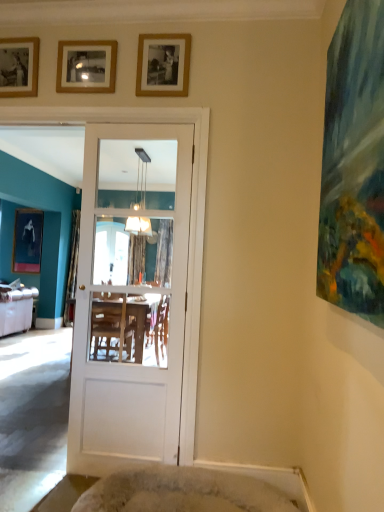
What do you see at coordinates (86, 66) in the screenshot? I see `wooden picture frame at upper center, which is counted as the second picture frame, starting from the right` at bounding box center [86, 66].

What are the coordinates of `wooden picture frame at upper center, acting as the third picture frame starting from the back` in the screenshot? It's located at (86, 66).

What is the approximate height of silky teal curtain at left?

7.11 feet.

Identify the location of silky teal curtain at left. (72, 270).

Where is `beige plush cat bed at lower center`? beige plush cat bed at lower center is located at coordinates (182, 492).

Locate an element on the screen. The image size is (384, 512). matte black portrait at left, the 1th picture frame in the left-to-right sequence is located at coordinates (27, 240).

Find the location of a particular element. wooden picture frame at upper center, which is counted as the second picture frame, starting from the right is located at coordinates (86, 66).

Considering the sizes of objects wooden photo frame at upper left, which is the second picture frame in left-to-right order, and silky teal curtain at left in the image provided, who is taller, wooden photo frame at upper left, which is the second picture frame in left-to-right order, or silky teal curtain at left?

With more height is silky teal curtain at left.

Is wooden photo frame at upper left, the 3th picture frame from the front, bigger than silky teal curtain at left?

No.

From the image's perspective, which is above, wooden photo frame at upper left, the 3th picture frame from the front, or silky teal curtain at left?

wooden photo frame at upper left, the 3th picture frame from the front, appears higher in the image.

The height and width of the screenshot is (512, 384). Identify the location of curtain behind the wooden photo frame at upper left, the 2th picture frame in the back-to-front sequence. (72, 270).

Is matte black portrait at left, arranged as the 4th picture frame when viewed from the right, with silver metallic studio couch at left?

matte black portrait at left, arranged as the 4th picture frame when viewed from the right, and silver metallic studio couch at left are not in contact.

Is matte black portrait at left, placed as the fourth picture frame when sorted from front to back, inside or outside of silver metallic studio couch at left?

matte black portrait at left, placed as the fourth picture frame when sorted from front to back, is located beyond the bounds of silver metallic studio couch at left.

Consider the image. Is matte black portrait at left, placed as the fourth picture frame when sorted from front to back, smaller than silver metallic studio couch at left?

Correct, matte black portrait at left, placed as the fourth picture frame when sorted from front to back, occupies less space than silver metallic studio couch at left.

From the image's perspective, is matte black portrait at left, placed as the fourth picture frame when sorted from front to back, above or below silver metallic studio couch at left?

Clearly, from the image's perspective, matte black portrait at left, placed as the fourth picture frame when sorted from front to back, is above silver metallic studio couch at left.

Considering the positions of objects wooden picture frame at upper center, the second picture frame in the front-to-back sequence, and matte black portrait at left, which is the first picture frame in back-to-front order, in the image provided, who is more to the right, wooden picture frame at upper center, the second picture frame in the front-to-back sequence, or matte black portrait at left, which is the first picture frame in back-to-front order,?

wooden picture frame at upper center, the second picture frame in the front-to-back sequence.

Considering the sizes of objects wooden picture frame at upper center, which is counted as the second picture frame, starting from the right, and matte black portrait at left, arranged as the 4th picture frame when viewed from the right, in the image provided, who is smaller, wooden picture frame at upper center, which is counted as the second picture frame, starting from the right, or matte black portrait at left, arranged as the 4th picture frame when viewed from the right,?

wooden picture frame at upper center, which is counted as the second picture frame, starting from the right.

Between wooden picture frame at upper center, the third picture frame when ordered from left to right, and matte black portrait at left, placed as the fourth picture frame when sorted from front to back, which one has more height?

With more height is matte black portrait at left, placed as the fourth picture frame when sorted from front to back.

Consider the image. How distant is wooden picture frame at upper center, which is counted as the second picture frame, starting from the right, from matte black portrait at left, which is the first picture frame in back-to-front order?

A distance of 4.20 meters exists between wooden picture frame at upper center, which is counted as the second picture frame, starting from the right, and matte black portrait at left, which is the first picture frame in back-to-front order.

You are a GUI agent. You are given a task and a screenshot of the screen. Output one action in this format:
    pyautogui.click(x=<x>, y=<y>)
    Task: Click on the 3rd picture frame above the silky teal curtain at left (from the image's perspective)
    
    Given the screenshot: What is the action you would take?
    pyautogui.click(x=86, y=66)

Which of these two, wooden picture frame at upper center, which is counted as the second picture frame, starting from the right, or silky teal curtain at left, is wider?

With larger width is silky teal curtain at left.

Considering the sizes of objects wooden picture frame at upper center, which is counted as the second picture frame, starting from the right, and silky teal curtain at left in the image provided, who is shorter, wooden picture frame at upper center, which is counted as the second picture frame, starting from the right, or silky teal curtain at left?

With less height is wooden picture frame at upper center, which is counted as the second picture frame, starting from the right.

Is wooden photo frame at upper left, the 2th picture frame in the back-to-front sequence, not close to wooden picture frame at upper center, the third picture frame when ordered from left to right?

No, there isn't a large distance between wooden photo frame at upper left, the 2th picture frame in the back-to-front sequence, and wooden picture frame at upper center, the third picture frame when ordered from left to right.

Where is `picture frame that is above the wooden picture frame at upper center, acting as the third picture frame starting from the back (from the image's perspective)`? picture frame that is above the wooden picture frame at upper center, acting as the third picture frame starting from the back (from the image's perspective) is located at coordinates [19, 67].

Is wooden photo frame at upper left, the 3th picture frame from the front, taller or shorter than wooden picture frame at upper center, which is counted as the second picture frame, starting from the right?

Considering their sizes, wooden photo frame at upper left, the 3th picture frame from the front, has more height than wooden picture frame at upper center, which is counted as the second picture frame, starting from the right.

Considering the relative sizes of matte black portrait at left, the 1th picture frame in the left-to-right sequence, and gold-framed photo at upper center, the first picture frame positioned from the front, in the image provided, is matte black portrait at left, the 1th picture frame in the left-to-right sequence, smaller than gold-framed photo at upper center, the first picture frame positioned from the front,?

No.

Is matte black portrait at left, placed as the fourth picture frame when sorted from front to back, facing towards gold-framed photo at upper center, the fourth picture frame when ordered from left to right?

No, matte black portrait at left, placed as the fourth picture frame when sorted from front to back, is not facing towards gold-framed photo at upper center, the fourth picture frame when ordered from left to right.

Which of these two, matte black portrait at left, which is the first picture frame in back-to-front order, or gold-framed photo at upper center, the fourth picture frame when ordered from left to right, stands taller?

With more height is matte black portrait at left, which is the first picture frame in back-to-front order.

Can you tell me how much matte black portrait at left, which is the first picture frame in back-to-front order, and gold-framed photo at upper center, the first picture frame positioned from the front, differ in facing direction?

The angle between the facing direction of matte black portrait at left, which is the first picture frame in back-to-front order, and the facing direction of gold-framed photo at upper center, the first picture frame positioned from the front, is 2.62 degrees.

Consider the image. Is beige plush cat bed at lower center to the left of matte black portrait at left, placed as the fourth picture frame when sorted from front to back, from the viewer's perspective?

No.

Is matte black portrait at left, arranged as the 4th picture frame when viewed from the right, at the back of beige plush cat bed at lower center?

No, beige plush cat bed at lower center is not facing away from matte black portrait at left, arranged as the 4th picture frame when viewed from the right.

Which is correct: beige plush cat bed at lower center is inside matte black portrait at left, arranged as the 4th picture frame when viewed from the right, or outside of it?

beige plush cat bed at lower center is located beyond the bounds of matte black portrait at left, arranged as the 4th picture frame when viewed from the right.

Who is taller, beige plush cat bed at lower center or matte black portrait at left, arranged as the 4th picture frame when viewed from the right?

matte black portrait at left, arranged as the 4th picture frame when viewed from the right, is taller.

Where is `the 1st picture frame counting from the right of the silky teal curtain at left`? the 1st picture frame counting from the right of the silky teal curtain at left is located at coordinates (19, 67).

What are the coordinates of `the 1st picture frame above the silver metallic studio couch at left (from a real-world perspective)` in the screenshot? It's located at (27, 240).

Estimate the real-world distances between objects in this image. Which object is further from gold-framed photo at upper center, the first picture frame positioned from the front, wooden photo frame at upper left, which is the second picture frame in left-to-right order, or matte black portrait at left, the 1th picture frame in the left-to-right sequence?

matte black portrait at left, the 1th picture frame in the left-to-right sequence, is further to gold-framed photo at upper center, the first picture frame positioned from the front.

From the image, which object appears to be farther from silver metallic studio couch at left, matte black portrait at left, placed as the fourth picture frame when sorted from front to back, or wooden photo frame at upper left, the 3th picture frame from the front?

Among the two, wooden photo frame at upper left, the 3th picture frame from the front, is located further to silver metallic studio couch at left.

From the image, which object appears to be nearer to wooden picture frame at upper center, acting as the third picture frame starting from the back, gold-framed photo at upper center, the fourth picture frame in the back-to-front sequence, or silver metallic studio couch at left?

Among the two, gold-framed photo at upper center, the fourth picture frame in the back-to-front sequence, is located nearer to wooden picture frame at upper center, acting as the third picture frame starting from the back.

Estimate the real-world distances between objects in this image. Which object is closer to gold-framed photo at upper center, arranged as the 1th picture frame when viewed from the right, silver metallic studio couch at left or silky teal curtain at left?

silky teal curtain at left.

From the image, which object appears to be nearer to white glossy door at center, gold-framed photo at upper center, arranged as the 1th picture frame when viewed from the right, or matte black portrait at left, arranged as the 4th picture frame when viewed from the right?

The object closer to white glossy door at center is matte black portrait at left, arranged as the 4th picture frame when viewed from the right.

Based on their spatial positions, is gold-framed photo at upper center, arranged as the 1th picture frame when viewed from the right, or wooden picture frame at upper center, the second picture frame in the front-to-back sequence, closer to silky teal curtain at left?

wooden picture frame at upper center, the second picture frame in the front-to-back sequence.

Considering their positions, is wooden picture frame at upper center, the second picture frame in the front-to-back sequence, positioned further to white glossy door at center than beige plush cat bed at lower center?

The object further to white glossy door at center is wooden picture frame at upper center, the second picture frame in the front-to-back sequence.

Looking at the image, which one is located further to silver metallic studio couch at left, beige plush cat bed at lower center or matte black portrait at left, the 1th picture frame in the left-to-right sequence?

beige plush cat bed at lower center lies further to silver metallic studio couch at left than the other object.

You are a GUI agent. You are given a task and a screenshot of the screen. Output one action in this format:
    pyautogui.click(x=<x>, y=<y>)
    Task: Click on the door between beige plush cat bed at lower center and matte black portrait at left, placed as the fourth picture frame when sorted from front to back, in the front-back direction
    The image size is (384, 512).
    Given the screenshot: What is the action you would take?
    pyautogui.click(x=130, y=309)

I want to click on studio couch positioned between gold-framed photo at upper center, the fourth picture frame in the back-to-front sequence, and matte black portrait at left, placed as the fourth picture frame when sorted from front to back, from near to far, so click(x=16, y=310).

Find the location of a particular element. This screenshot has height=512, width=384. studio couch between beige plush cat bed at lower center and matte black portrait at left, arranged as the 4th picture frame when viewed from the right, from front to back is located at coordinates (16, 310).

At what (x,y) coordinates should I click in order to perform the action: click on studio couch between beige plush cat bed at lower center and silky teal curtain at left along the z-axis. Please return your answer as a coordinate pair (x, y). The width and height of the screenshot is (384, 512). Looking at the image, I should click on (16, 310).